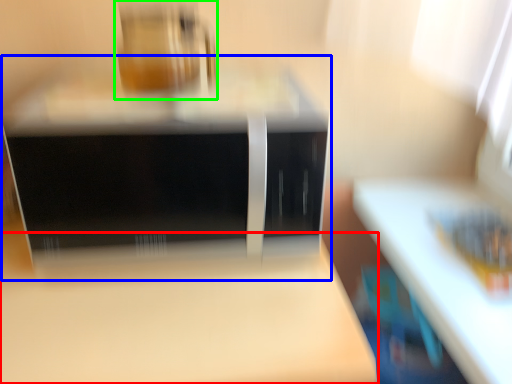
Question: Which is farther away from table (highlighted by a red box)? home appliance (highlighted by a blue box) or appliance (highlighted by a green box)?

Choices:
 (A) home appliance
 (B) appliance

Answer: (B)